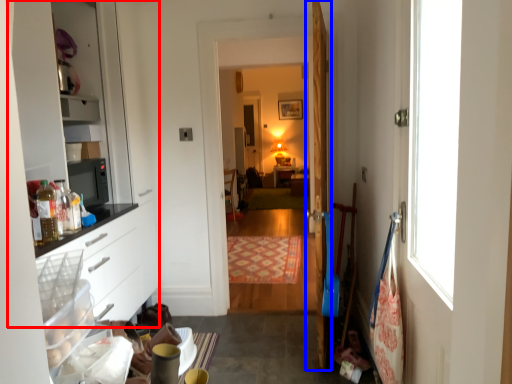
Question: Among these objects, which one is nearest to the camera, dresser (highlighted by a red box) or door (highlighted by a blue box)?

Choices:
 (A) dresser
 (B) door

Answer: (A)